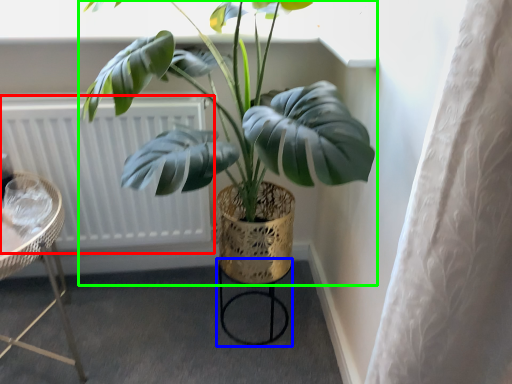
Question: Which is nearer to the radiator (highlighted by a red box)? bar stool (highlighted by a blue box) or houseplant (highlighted by a green box).

Choices:
 (A) bar stool
 (B) houseplant

Answer: (B)